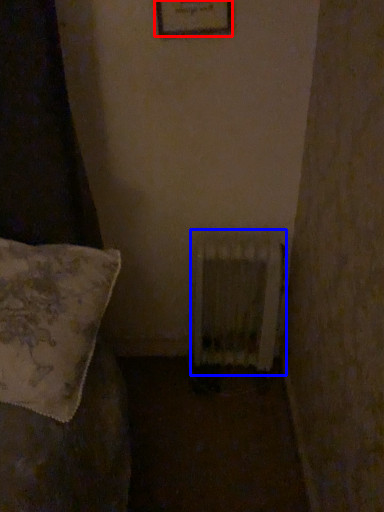
Question: Which of the following is the farthest to the observer, picture frame (highlighted by a red box) or radiator (highlighted by a blue box)?

Choices:
 (A) picture frame
 (B) radiator

Answer: (B)